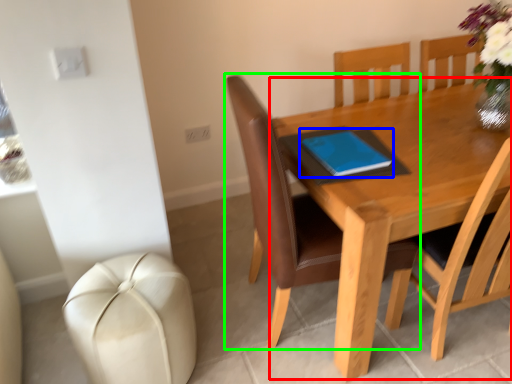
Question: Which is nearer to the round table (highlighted by a red box)? notebook (highlighted by a blue box) or chair (highlighted by a green box).

Choices:
 (A) notebook
 (B) chair

Answer: (A)